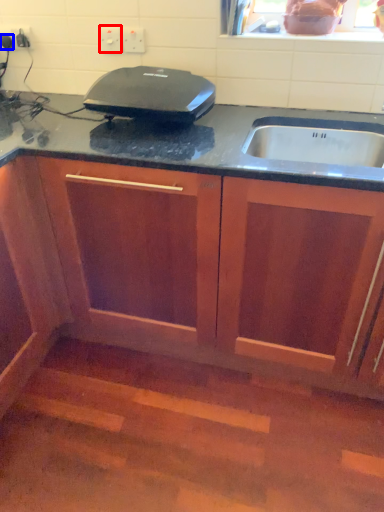
Question: Which object is closer to the camera taking this photo, electric outlet (highlighted by a red box) or kitchen appliance (highlighted by a blue box)?

Choices:
 (A) electric outlet
 (B) kitchen appliance

Answer: (A)